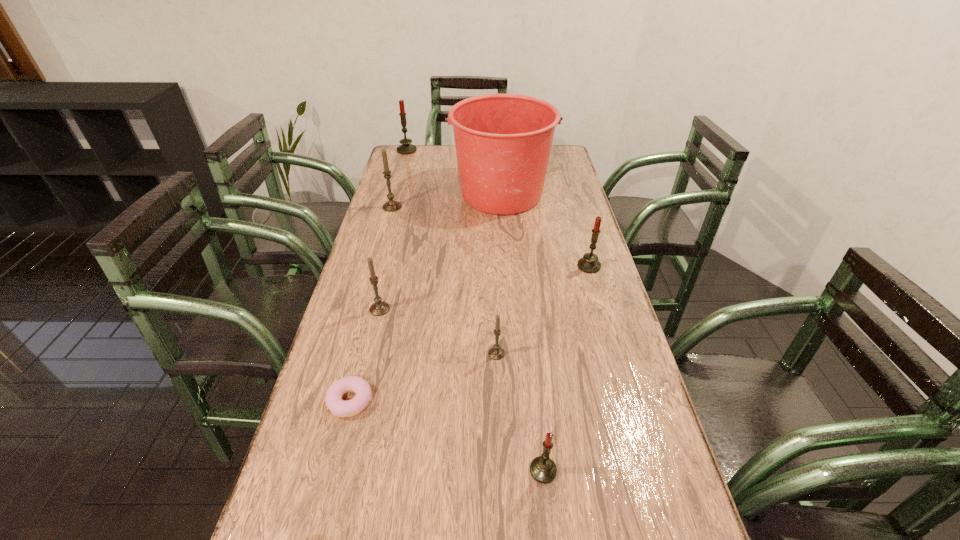
I want to click on vacant space that satisfies the following two spatial constraints: 1. on the back side of the fourth candle from left to right; 2. on the right side of the fourth farthest object, so click(x=493, y=266).

Identify the location of vacant space that satisfies the following two spatial constraints: 1. on the front side of the nearest candle; 2. on the right side of the farthest gray candle. (319, 470).